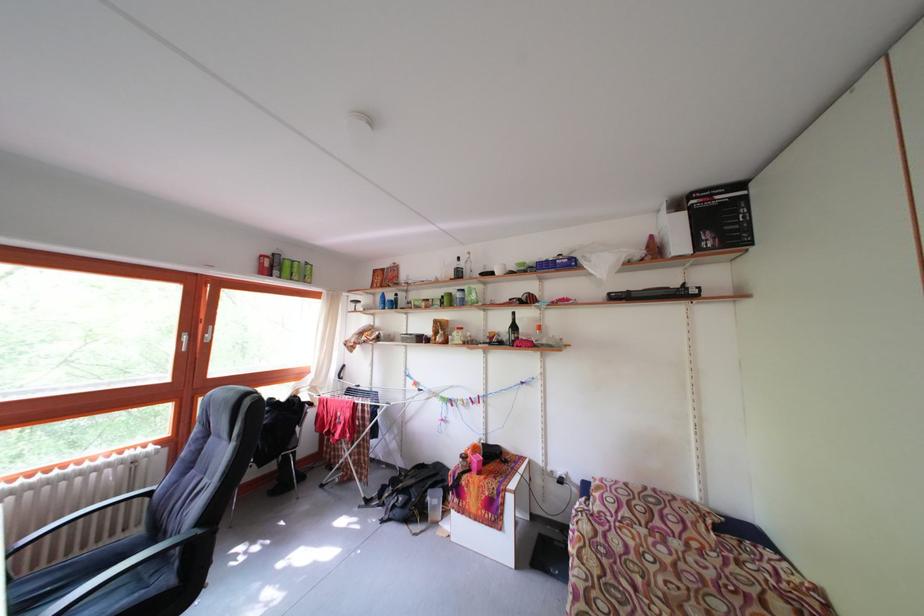
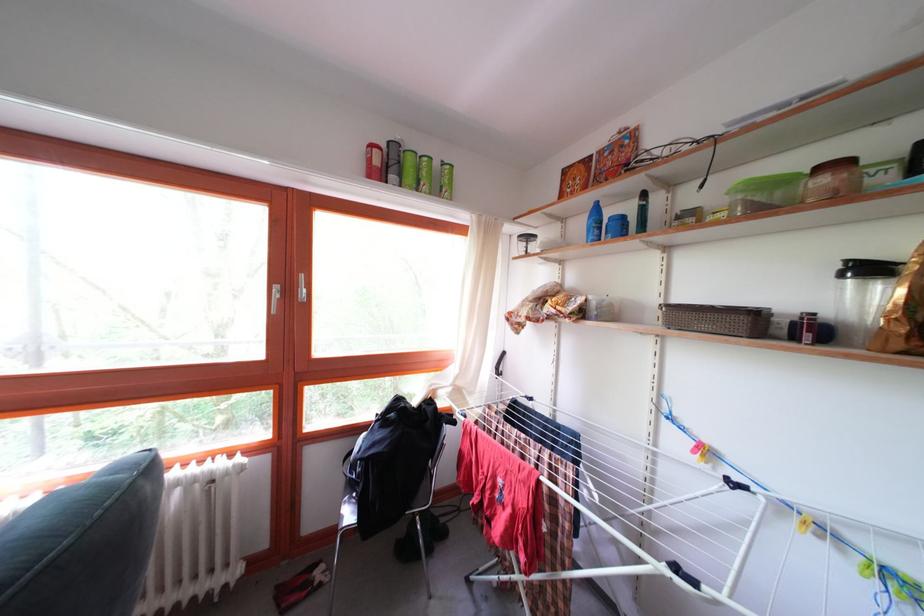
Where in the second image is the point corresponding to pixel 314 270 from the first image?

(452, 169)